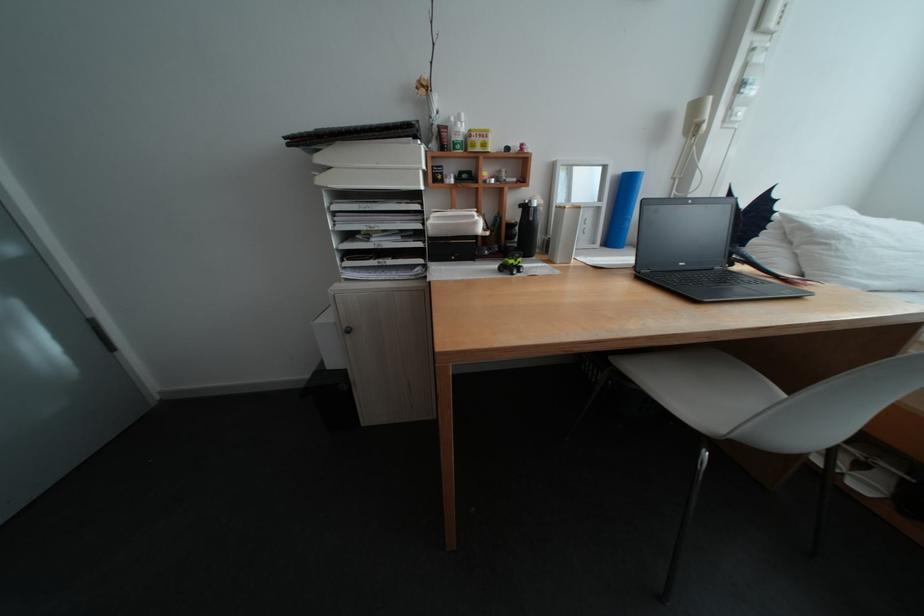
Image resolution: width=924 pixels, height=616 pixels. In order to click on white box lid in this screenshot , I will do `click(371, 155)`.